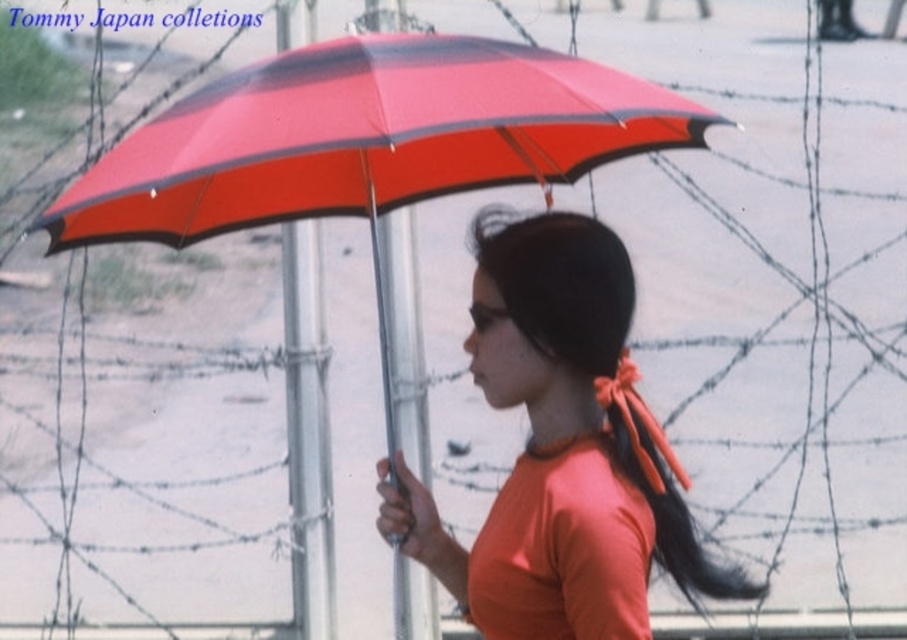
Question: From the image, what is the correct spatial relationship of orange matte shirt at center in relation to orange fabric ponytail at center?

Choices:
 (A) left
 (B) right

Answer: (A)

Question: Does orange matte shirt at center have a greater width compared to orange fabric ponytail at center?

Choices:
 (A) no
 (B) yes

Answer: (B)

Question: Which of the following is the closest to the observer?

Choices:
 (A) (480, 236)
 (B) (675, 477)

Answer: (B)

Question: In this image, where is orange matte shirt at center located relative to orange fabric ponytail at center?

Choices:
 (A) above
 (B) below

Answer: (A)